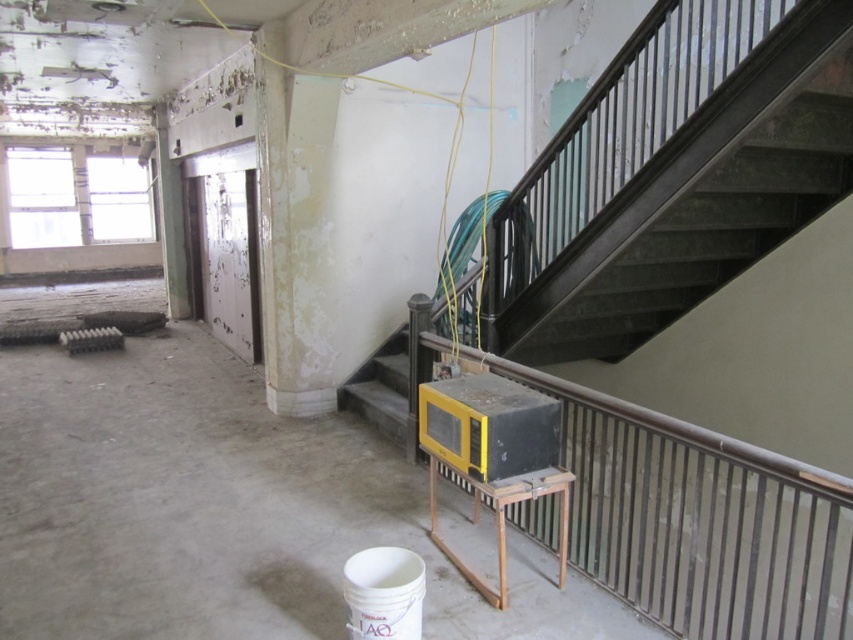
You are a delivery person trying to place a package on the wooden stool at center. However, there is a yellow plastic stairwell at center in the way. Which object should you move to access the stool?

The wooden stool at center is positioned on the right side of the yellow plastic stairwell at center. To access the stool, you should move the yellow plastic stairwell at center out of the way.